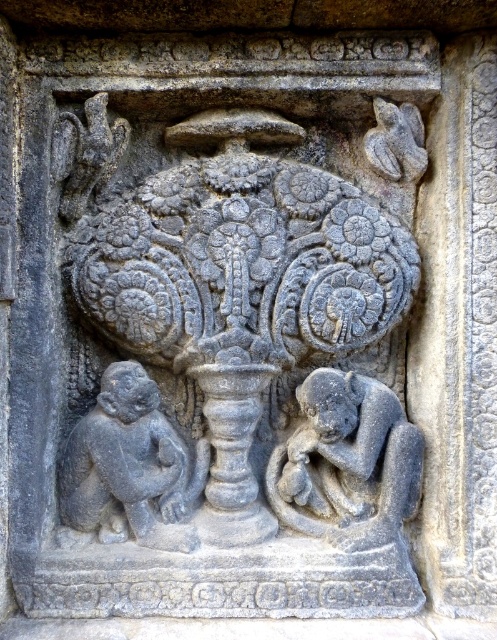
You are an archaeologist examining the ancient stone carving. You notice the gray stone vase at center and the gray stone monkey at lower right. Based on their positions, which object is placed higher up in the image?

The gray stone vase at center is positioned over the gray stone monkey at lower right, meaning it is placed higher up in the image.

You are an archaeologist examining the stone carving. You notice a point labeled at coordinates [346,461]. What object is located at this point?

The point at coordinates [346,461] indicates a gray stone monkey at lower right.